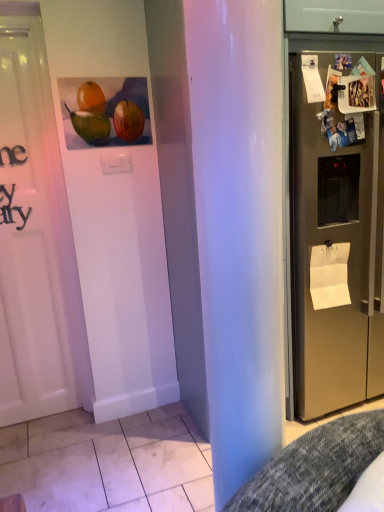
Question: Considering the positions of white paper at upper right, the 1th paper when ordered from top to bottom, and satin silver refrigerator at right in the image, is white paper at upper right, the 1th paper when ordered from top to bottom, wider or thinner than satin silver refrigerator at right?

Choices:
 (A) wide
 (B) thin

Answer: (B)

Question: Is white paper at upper right, positioned as the first paper in front-to-back order, bigger or smaller than satin silver refrigerator at right?

Choices:
 (A) big
 (B) small

Answer: (B)

Question: Considering the real-world distances, which object is closest to the white paper at upper right, marked as the 2th paper in a back-to-front arrangement?

Choices:
 (A) satin silver refrigerator at right
 (B) matte acrylic painting of fruits at upper left
 (C) white paper at right, which is the second paper in top-to-bottom order

Answer: (A)

Question: Which object is positioned closest to the white paper at right, the 1th paper viewed from the right?

Choices:
 (A) matte acrylic painting of fruits at upper left
 (B) satin silver refrigerator at right
 (C) white paper at upper right, which is counted as the 1th paper, starting from the left

Answer: (B)